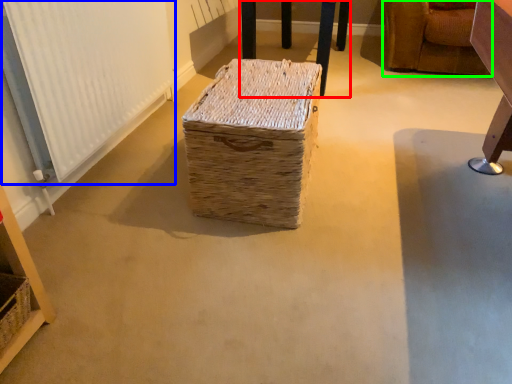
Question: Considering the real-world distances, which object is farthest from furniture (highlighted by a red box)? radiator (highlighted by a blue box) or furniture (highlighted by a green box)?

Choices:
 (A) radiator
 (B) furniture

Answer: (A)